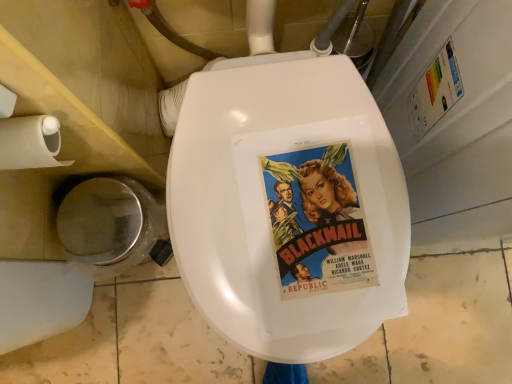
Question: Does vivid paper poster at center appear on the right side of beige paper towel at left?

Choices:
 (A) no
 (B) yes

Answer: (B)

Question: Does vivid paper poster at center have a lesser height compared to beige paper towel at left?

Choices:
 (A) no
 (B) yes

Answer: (B)

Question: Is vivid paper poster at center taller than beige paper towel at left?

Choices:
 (A) no
 (B) yes

Answer: (A)

Question: Does vivid paper poster at center appear on the left side of beige paper towel at left?

Choices:
 (A) no
 (B) yes

Answer: (A)

Question: Does vivid paper poster at center have a larger size compared to beige paper towel at left?

Choices:
 (A) yes
 (B) no

Answer: (B)

Question: From the image's perspective, is vivid paper poster at center beneath beige paper towel at left?

Choices:
 (A) no
 (B) yes

Answer: (B)

Question: From the image's perspective, is vivid paper poster at center located beneath shiny metallic trash can at lower left?

Choices:
 (A) no
 (B) yes

Answer: (A)

Question: Is vivid paper poster at center closer to the viewer compared to shiny metallic trash can at lower left?

Choices:
 (A) yes
 (B) no

Answer: (A)

Question: Does vivid paper poster at center lie behind shiny metallic trash can at lower left?

Choices:
 (A) no
 (B) yes

Answer: (A)

Question: Is vivid paper poster at center not inside shiny metallic trash can at lower left?

Choices:
 (A) no
 (B) yes

Answer: (B)

Question: Can you confirm if vivid paper poster at center is taller than shiny metallic trash can at lower left?

Choices:
 (A) no
 (B) yes

Answer: (A)

Question: Could you tell me if vivid paper poster at center is turned towards shiny metallic trash can at lower left?

Choices:
 (A) yes
 (B) no

Answer: (B)

Question: Does beige paper towel at left lie behind shiny metallic trash can at lower left?

Choices:
 (A) no
 (B) yes

Answer: (A)